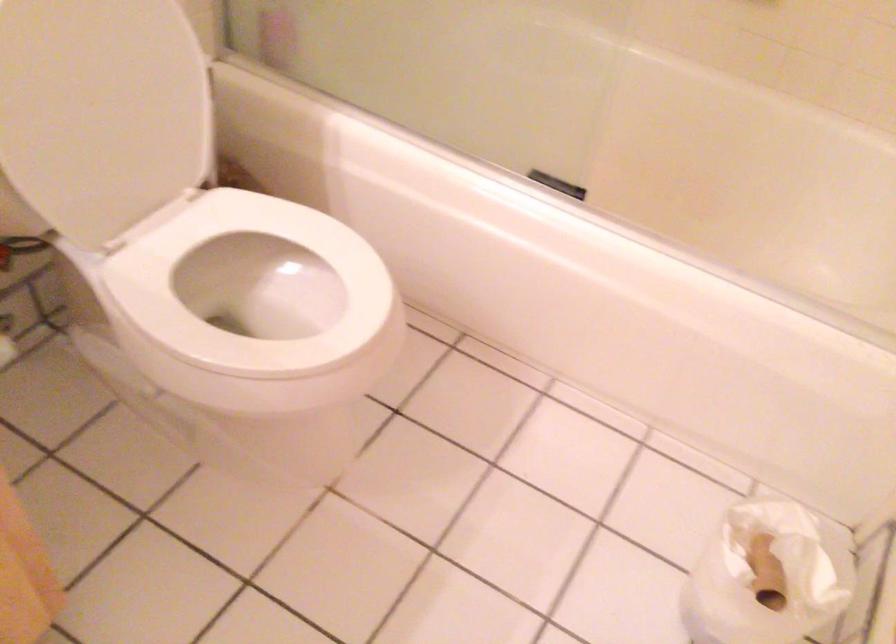
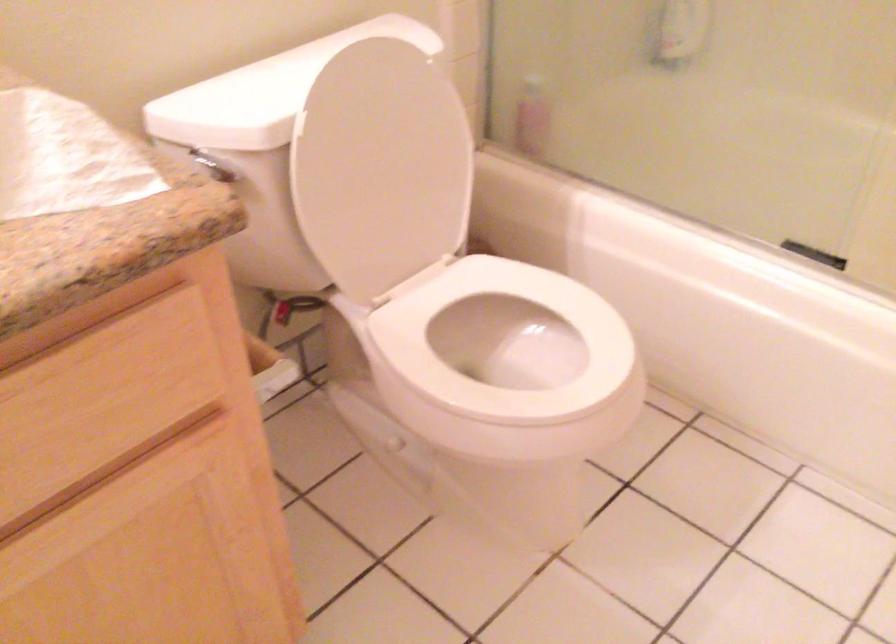
Find the pixel in the second image that matches point (265, 286) in the first image.

(504, 348)